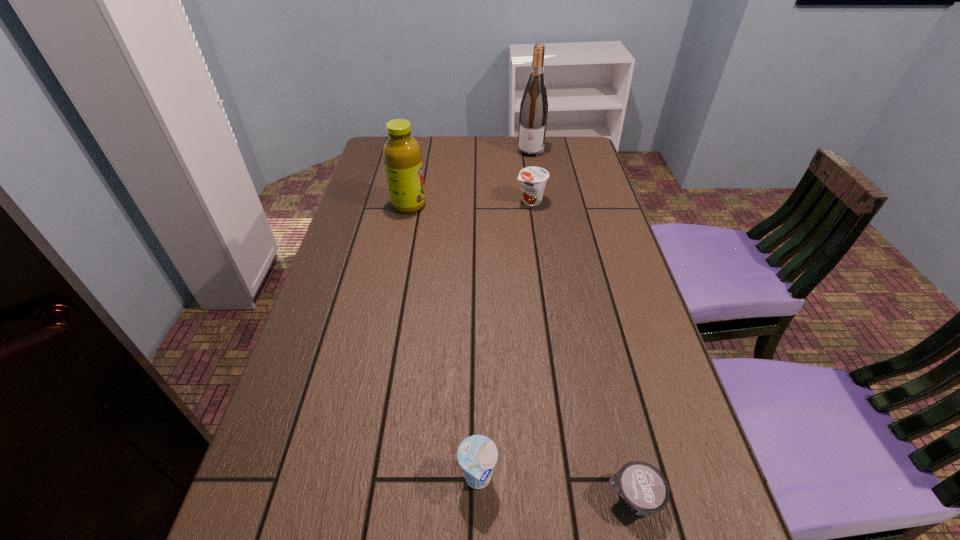
This screenshot has width=960, height=540. I want to click on vacant space that is in between the leftmost yogurt and the rightmost yogurt, so click(x=555, y=488).

Locate an element on the screen. empty space that is in between the second tallest object and the leftmost yogurt is located at coordinates (444, 342).

The image size is (960, 540). In order to click on empty space that is in between the fourth object from right to left and the second yogurt from right to left in this screenshot , I will do point(504,340).

Image resolution: width=960 pixels, height=540 pixels. What are the coordinates of `blank region between the second yogurt from right to left and the fourth shortest object` in the screenshot? It's located at (469, 203).

This screenshot has height=540, width=960. Find the location of `empty location between the leftmost yogurt and the rightmost yogurt`. empty location between the leftmost yogurt and the rightmost yogurt is located at coordinates (555, 488).

The image size is (960, 540). I want to click on free space between the tallest object and the shortest yogurt, so click(x=582, y=324).

Where is `vacant space that's between the fruit juice and the farthest object`? The width and height of the screenshot is (960, 540). vacant space that's between the fruit juice and the farthest object is located at coordinates (469, 178).

The height and width of the screenshot is (540, 960). Find the location of `vacant region between the shortest yogurt and the wine bottle`. vacant region between the shortest yogurt and the wine bottle is located at coordinates (582, 324).

Identify the location of free area in between the farthest object and the shortest object. This screenshot has height=540, width=960. (582, 324).

Find the location of `object that is the third closest to the farthest yogurt`. object that is the third closest to the farthest yogurt is located at coordinates (477, 454).